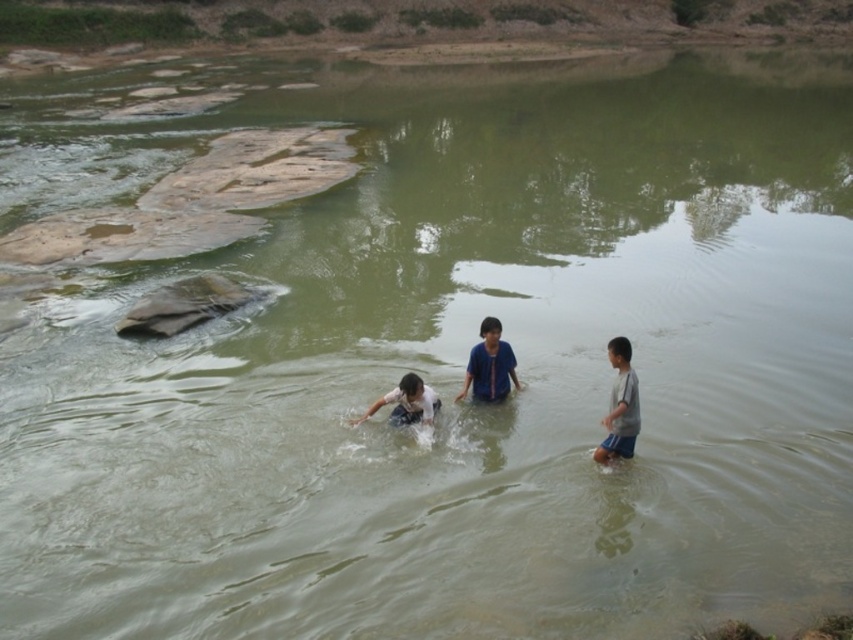
Looking at this image, you are standing at the camera position and want to reach the blue cotton shirt at center. Which direction should you move to get closer to it?

Since the blue cotton shirt at center is located at point (x=489, y=365) in the image, you should move forward towards the center of the scene to reach it.

You are a photographer standing on the riverbank and want to take a photo of the two boys in the water. Which boy should you focus on first to ensure both are in the frame? The boys are the blue cotton shirt at center and the light blue fabric shirt at center.

You should focus on the blue cotton shirt at center first because it is closer to you than the light blue fabric shirt at center, ensuring both will be in the frame.